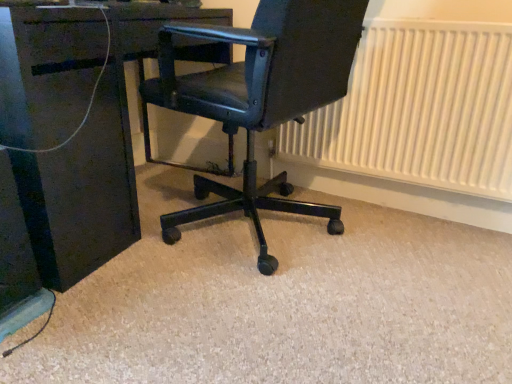
Question: Are matte black office chair at center and white textured radiator at right far apart?

Choices:
 (A) no
 (B) yes

Answer: (A)

Question: Does matte black office chair at center have a larger size compared to white textured radiator at right?

Choices:
 (A) yes
 (B) no

Answer: (A)

Question: Are matte black office chair at center and white textured radiator at right beside each other?

Choices:
 (A) no
 (B) yes

Answer: (A)

Question: Does matte black office chair at center have a greater width compared to white textured radiator at right?

Choices:
 (A) no
 (B) yes

Answer: (B)

Question: Is matte black office chair at center at the right side of white textured radiator at right?

Choices:
 (A) no
 (B) yes

Answer: (A)

Question: Choose the correct answer: Is white textured radiator at right inside matte black desk at center or outside it?

Choices:
 (A) outside
 (B) inside

Answer: (A)

Question: From the image's perspective, relative to matte black desk at center, is white textured radiator at right above or below?

Choices:
 (A) below
 (B) above

Answer: (A)

Question: Would you say white textured radiator at right is to the left or to the right of matte black desk at center in the picture?

Choices:
 (A) left
 (B) right

Answer: (B)

Question: Is white textured radiator at right in front of or behind matte black desk at center in the image?

Choices:
 (A) front
 (B) behind

Answer: (B)

Question: Is matte black desk at center spatially inside matte black office chair at center, or outside of it?

Choices:
 (A) outside
 (B) inside

Answer: (A)

Question: Is point (55, 258) closer or farther from the camera than point (256, 46)?

Choices:
 (A) farther
 (B) closer

Answer: (A)

Question: From a real-world perspective, is matte black desk at center physically located above or below matte black office chair at center?

Choices:
 (A) above
 (B) below

Answer: (B)

Question: Is matte black desk at center taller or shorter than matte black office chair at center?

Choices:
 (A) short
 (B) tall

Answer: (A)

Question: From the image's perspective, is matte black office chair at center located above or below matte black desk at center?

Choices:
 (A) below
 (B) above

Answer: (A)

Question: In terms of width, does matte black office chair at center look wider or thinner when compared to matte black desk at center?

Choices:
 (A) wide
 (B) thin

Answer: (A)